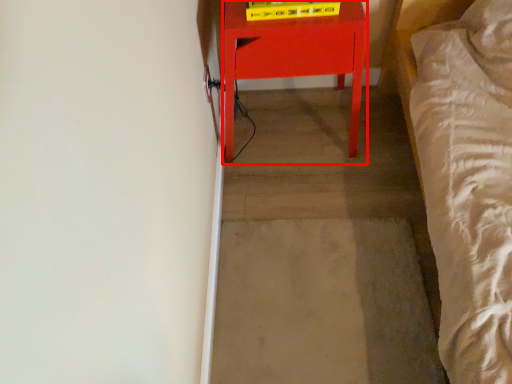
Question: From the image's perspective, where is furniture (annotated by the red box) located relative to concrete?

Choices:
 (A) below
 (B) above

Answer: (B)